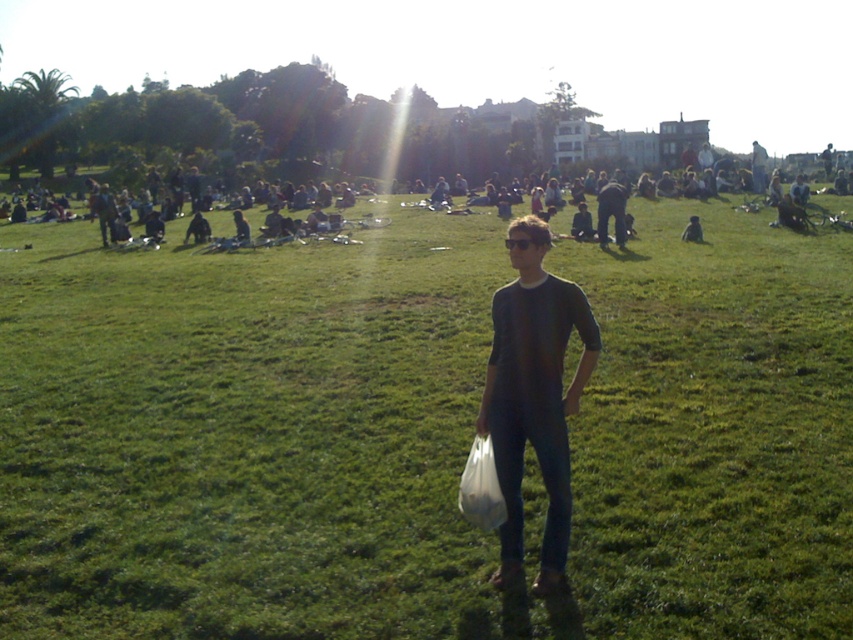
Can you confirm if dark gray shirt at center is positioned above dark blue jeans at center?

Actually, dark gray shirt at center is below dark blue jeans at center.

Is point (532, 348) positioned in front of point (622, 220)?

Yes, point (532, 348) is closer to viewer.

Identify the location of dark gray shirt at center. (534, 396).

I want to click on green grassy field at center, so click(x=418, y=435).

Measure the distance between point (154, 566) and camera.

Point (154, 566) and camera are 4.41 meters apart from each other.

Locate an element on the screen. green grassy field at center is located at coordinates (418, 435).

Is green grassy field at center wider than dark blue jeans at center?

Yes.

Between green grassy field at center and dark blue jeans at center, which one is positioned lower?

green grassy field at center is below.

Does point (758, 298) come farther from viewer compared to point (605, 227)?

No.

Identify the location of green grassy field at center. This screenshot has height=640, width=853. (418, 435).